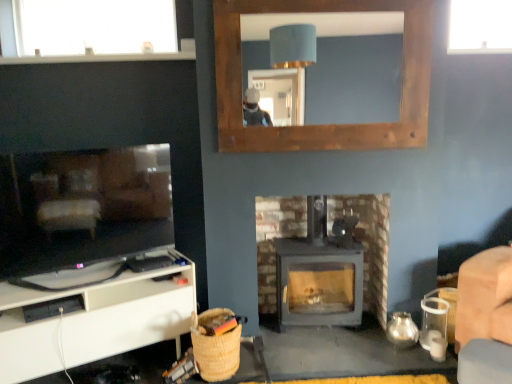
Question: Is transparent glass window at upper left, the second window viewed from the right, to the left or to the right of transparent glass window at upper right, placed as the first window when sorted from right to left, in the image?

Choices:
 (A) right
 (B) left

Answer: (B)

Question: Is transparent glass window at upper left, arranged as the first window when viewed from the left, wider or thinner than transparent glass window at upper right, placed as the first window when sorted from right to left?

Choices:
 (A) thin
 (B) wide

Answer: (A)

Question: Which of these objects is positioned closest to the wooden frame mirror at upper center?

Choices:
 (A) transparent glass window at upper right, placed as the second window when sorted from left to right
 (B) white matte cabinet at lower left
 (C) transparent glass window at upper left, the second window viewed from the right
 (D) matte gray wood stove at center
 (E) woven straw basket at lower left

Answer: (A)

Question: Which of these objects is positioned farthest from the woven straw basket at lower left?

Choices:
 (A) white matte cabinet at lower left
 (B) transparent glass window at upper right, placed as the first window when sorted from right to left
 (C) wooden frame mirror at upper center
 (D) transparent glass window at upper left, the second window viewed from the right
 (E) matte gray wood stove at center

Answer: (B)